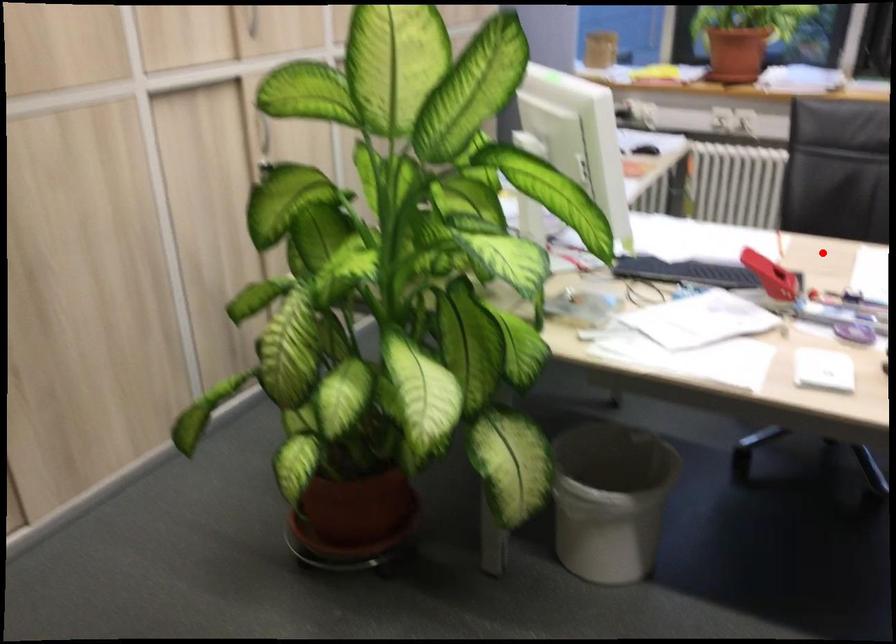
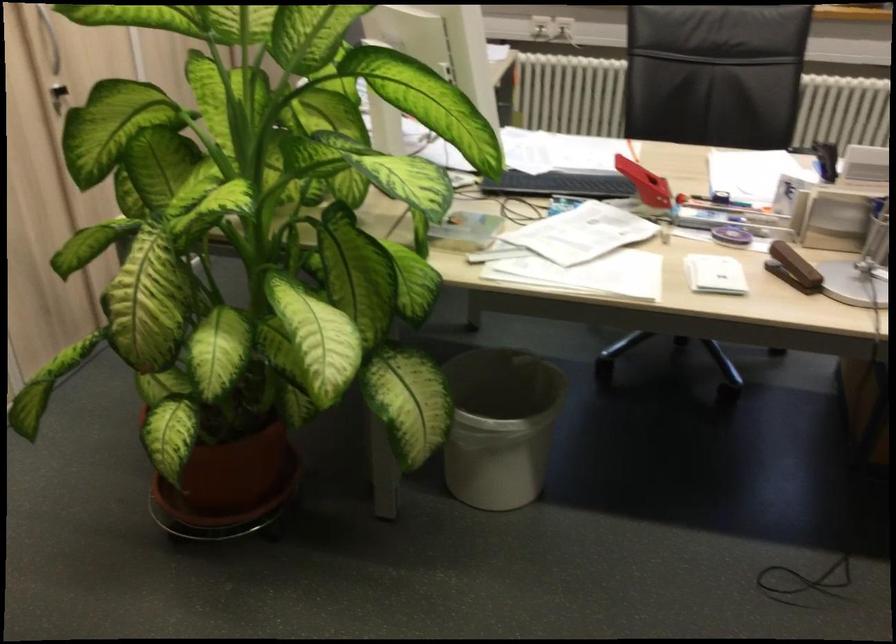
Question: I am providing you with two images of the same scene from different viewpoints. A red point is marked on the first image. At the location where the point appears in image 1, is it still visible in image 2?

Choices:
 (A) Yes
 (B) No

Answer: (A)